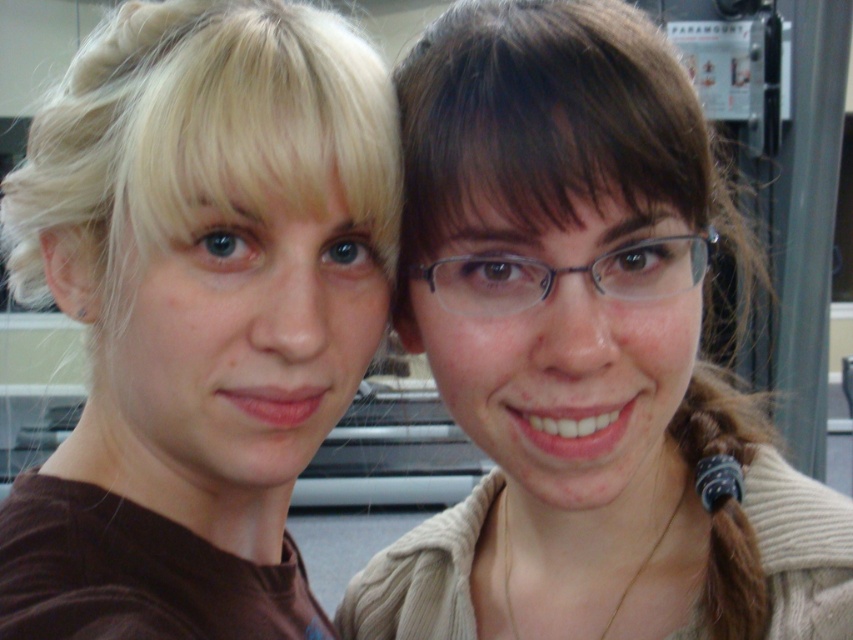
Is light brown sweater at center above clear plastic glasses at center?

Incorrect, light brown sweater at center is not positioned above clear plastic glasses at center.

Is light brown sweater at center positioned behind clear plastic glasses at center?

No, light brown sweater at center is in front of clear plastic glasses at center.

What do you see at coordinates (582, 353) in the screenshot? This screenshot has width=853, height=640. I see `light brown sweater at center` at bounding box center [582, 353].

Where is `light brown sweater at center`? light brown sweater at center is located at coordinates (582, 353).

Which is more to the left, light brown sweater at center or brown matte shirt at left?

brown matte shirt at left

Between light brown sweater at center and brown matte shirt at left, which one is positioned higher?

brown matte shirt at left is higher up.

The image size is (853, 640). What do you see at coordinates (582, 353) in the screenshot?
I see `light brown sweater at center` at bounding box center [582, 353].

Find the location of `light brown sweater at center`. light brown sweater at center is located at coordinates (582, 353).

Does brown matte shirt at left appear on the right side of clear plastic glasses at center?

Incorrect, brown matte shirt at left is not on the right side of clear plastic glasses at center.

Does brown matte shirt at left appear over clear plastic glasses at center?

No, brown matte shirt at left is not above clear plastic glasses at center.

I want to click on brown matte shirt at left, so click(x=196, y=312).